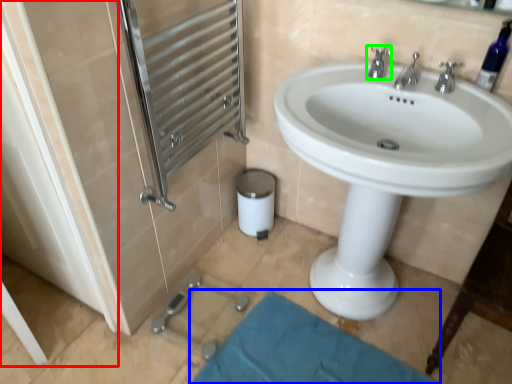
Question: Estimate the real-world distances between objects in this image. Which object is farther from screen door (highlighted by a red box), bath mat (highlighted by a blue box) or tap (highlighted by a green box)?

Choices:
 (A) bath mat
 (B) tap

Answer: (B)